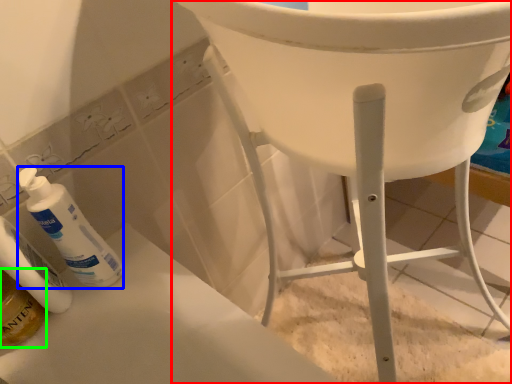
Question: Based on their relative distances, which object is farther from furniture (highlighted by a red box)? Choose from cleaning product (highlighted by a blue box) and mouthwash (highlighted by a green box).

Choices:
 (A) cleaning product
 (B) mouthwash

Answer: (B)